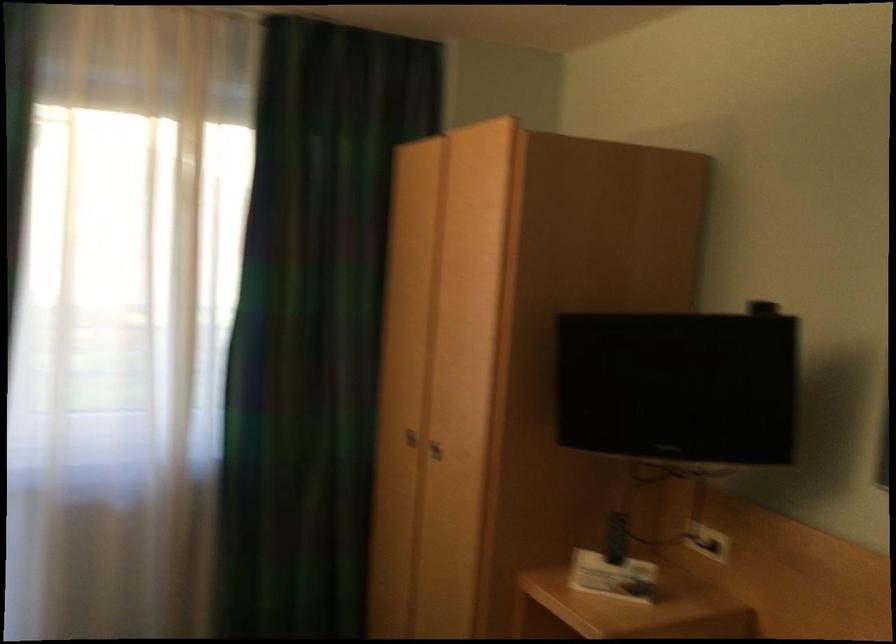
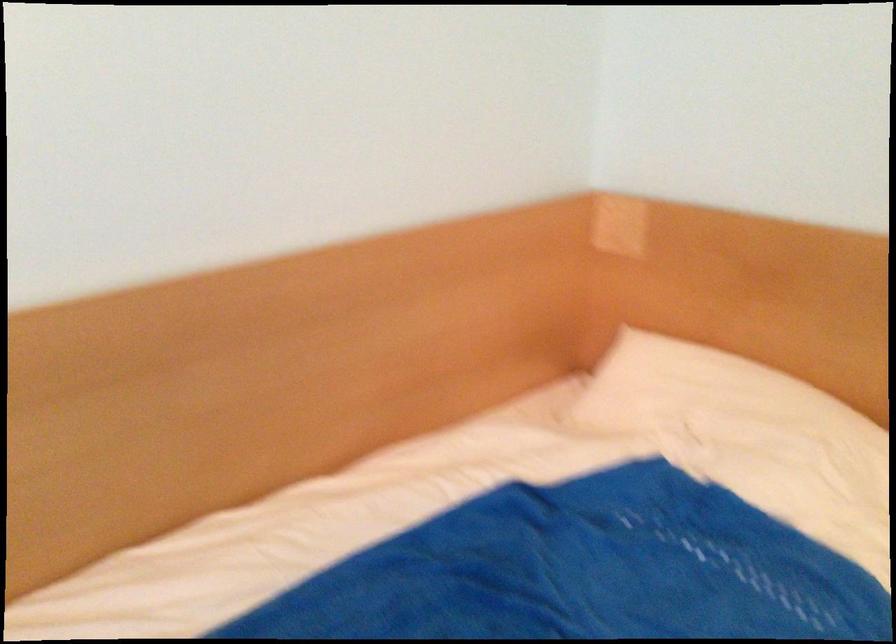
The images are taken continuously from a first-person perspective. In which direction is your viewpoint rotating?

The rotation direction of the camera is right-down.